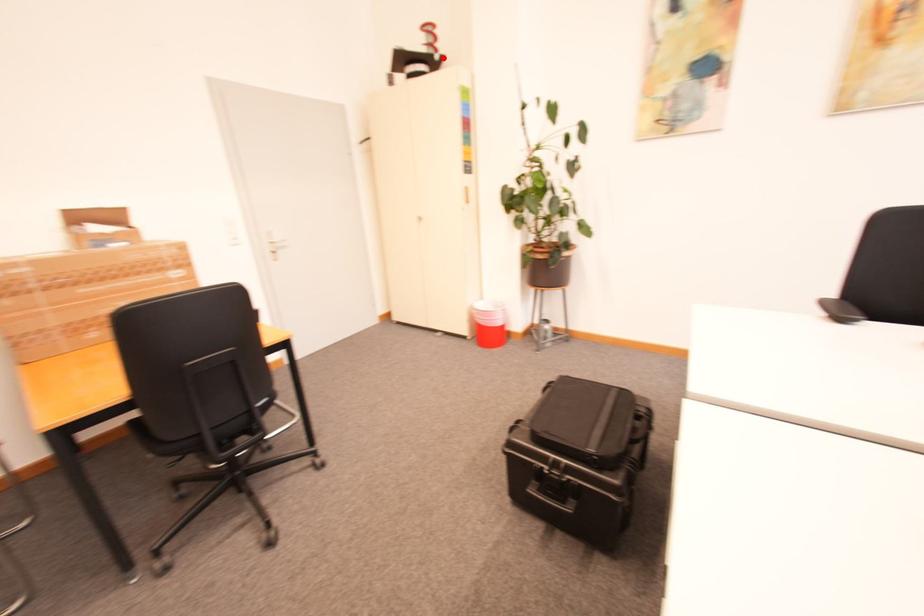
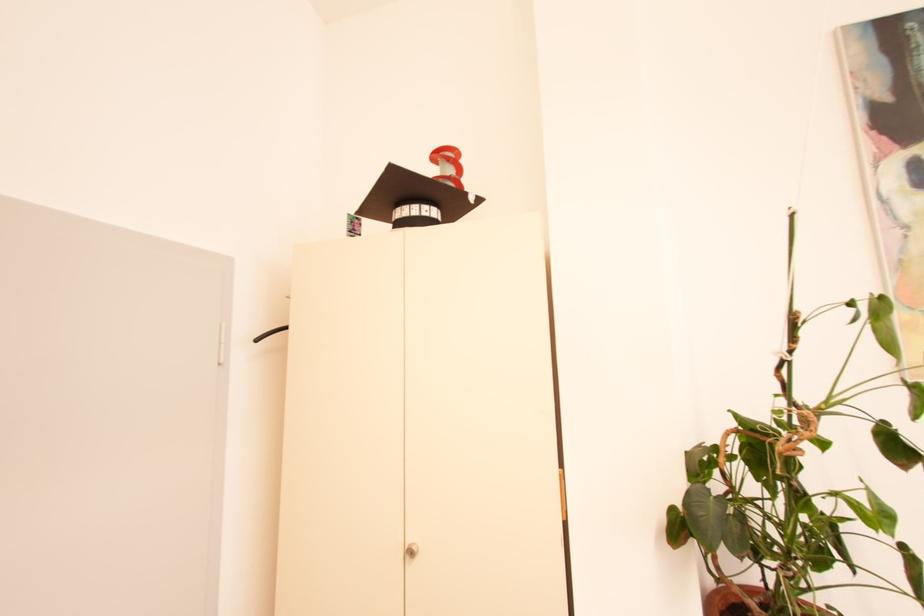
In the second image, find the point that corresponds to the highlighted location in the first image.

(478, 199)